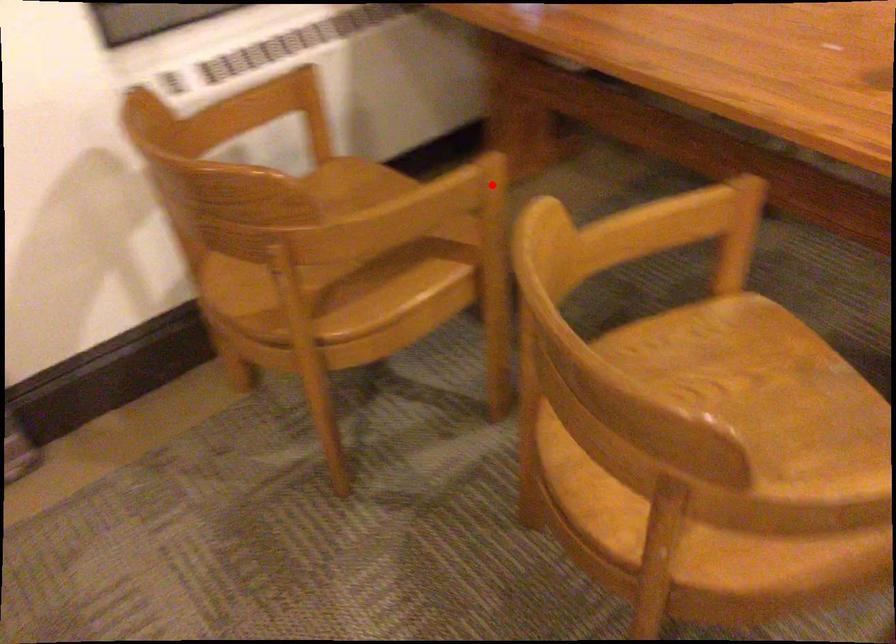
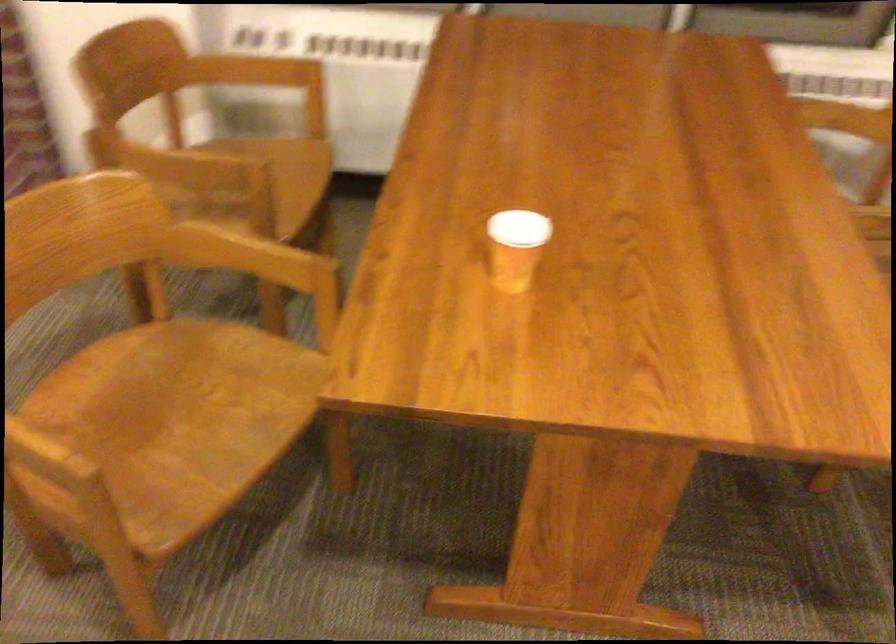
Locate, in the second image, the point that corresponds to the highlighted location in the first image.

(252, 182)